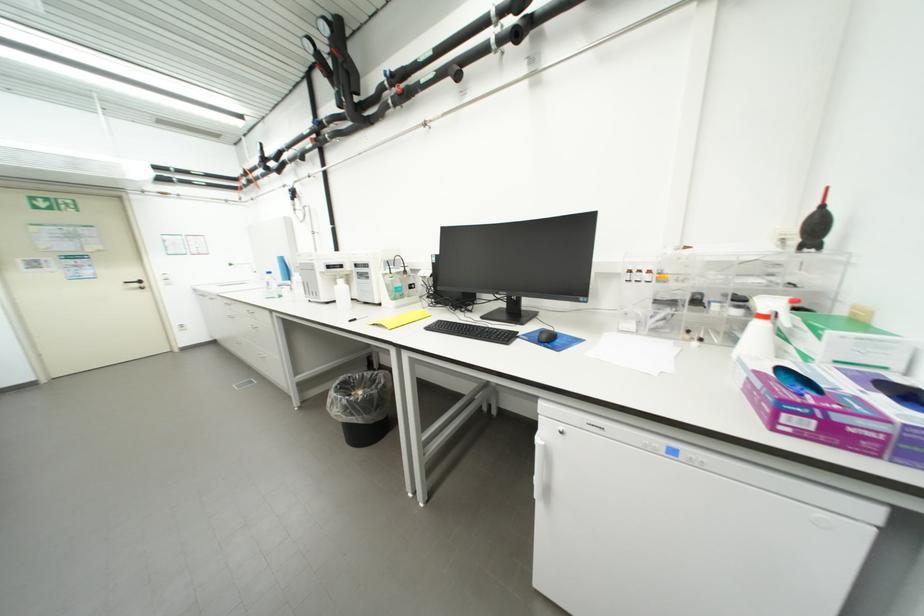
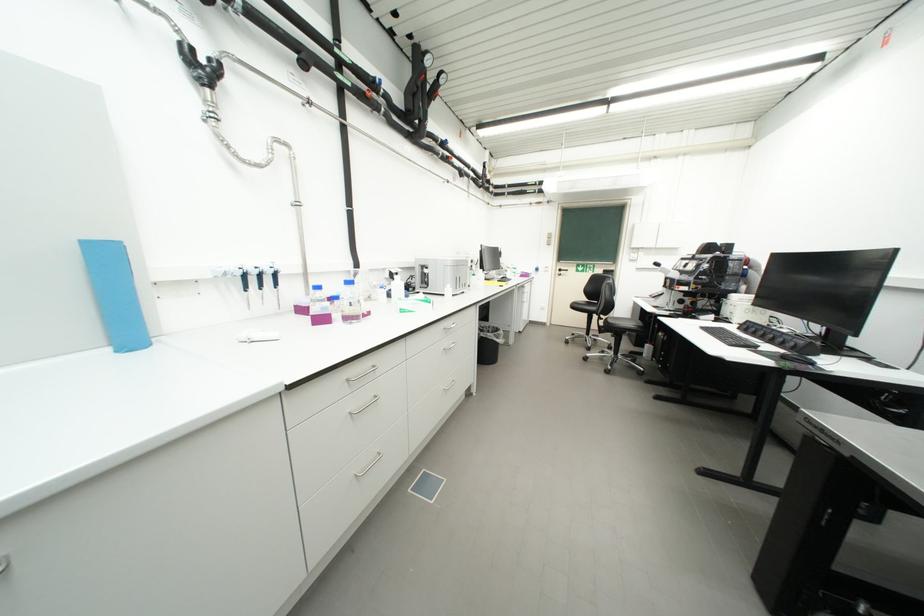
Question: I am providing you with two images of the same scene from different viewpoints. Please identify which objects are invisible in image2.

Choices:
 (A) radiator control valve
 (B) silver drawer handle
 (C) computer mouse
 (D) white fridge handle

Answer: (D)